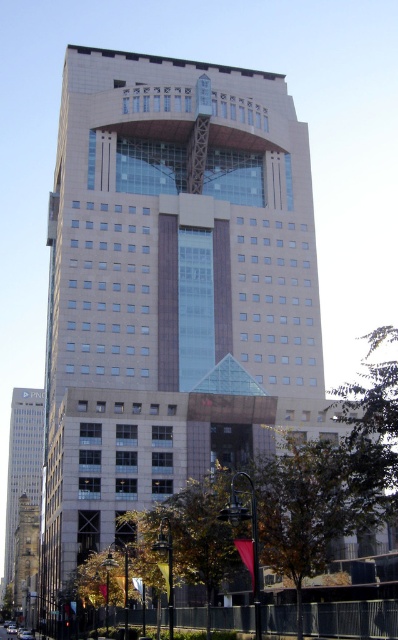
Question: Considering the real-world distances, which object is closest to the silver metallic sedan at center?

Choices:
 (A) stone tower at left
 (B) matte glass tower at left
 (C) silver metallic car at center
 (D) metallic silver car at lower left

Answer: (C)

Question: Considering the relative positions of stone tower at left and metallic silver car at lower left in the image provided, where is stone tower at left located with respect to metallic silver car at lower left?

Choices:
 (A) right
 (B) left

Answer: (B)

Question: Is stone tower at left wider than silver metallic car at center?

Choices:
 (A) yes
 (B) no

Answer: (A)

Question: Does stone tower at left have a larger size compared to metallic silver car at lower left?

Choices:
 (A) yes
 (B) no

Answer: (A)

Question: Which object is farther from the camera taking this photo?

Choices:
 (A) metallic silver car at lower left
 (B) silver metallic car at center
 (C) stone tower at left

Answer: (C)

Question: Estimate the real-world distances between objects in this image. Which object is farther from the silver metallic car at center?

Choices:
 (A) stone tower at left
 (B) metallic silver car at lower left
 (C) silver metallic sedan at center

Answer: (A)